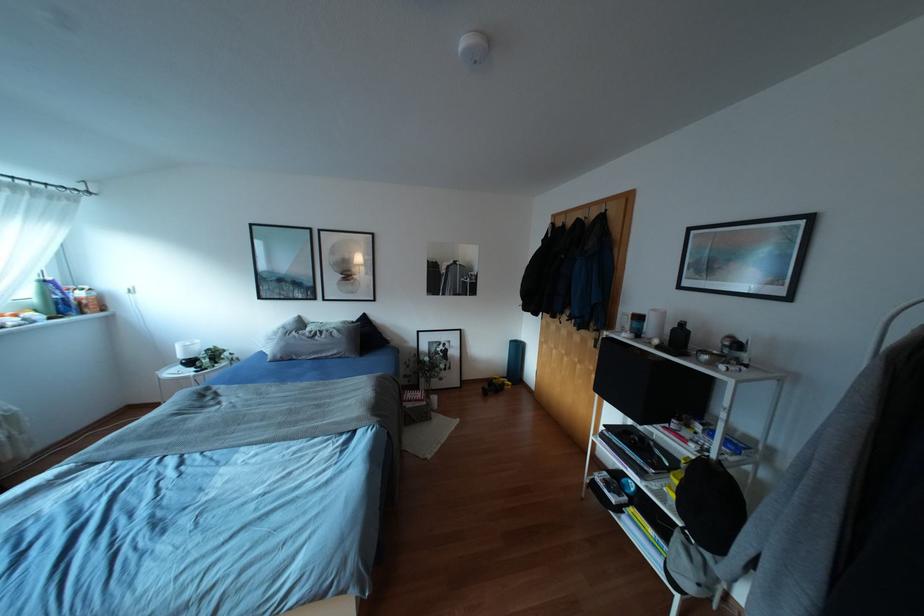
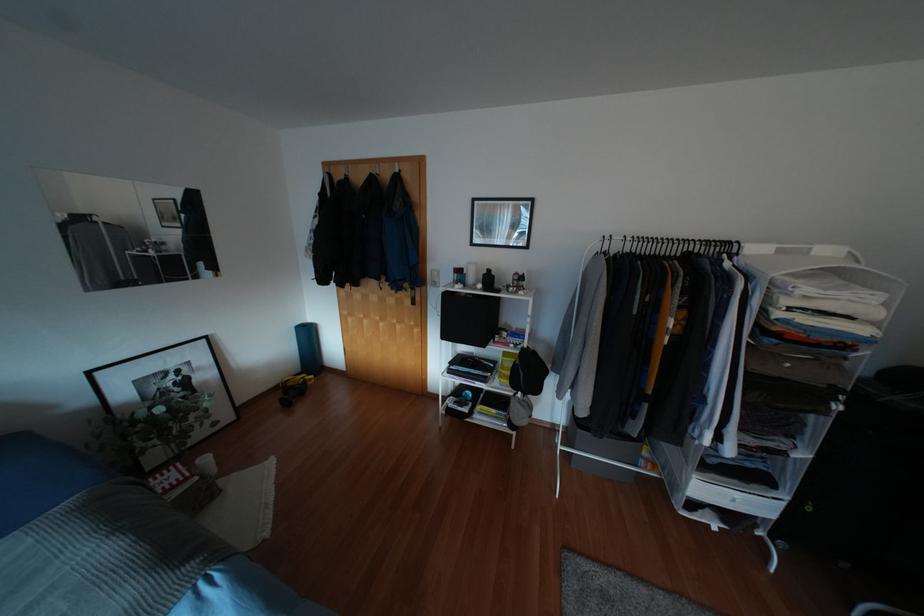
Locate, in the second image, the point that corresponds to point (658, 347) in the first image.

(483, 289)